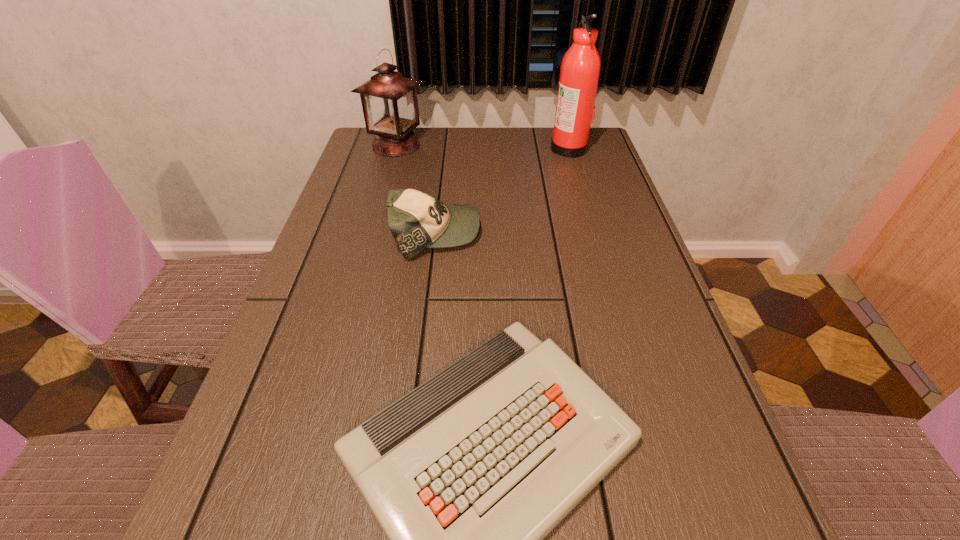
Where is `the tallest object`? the tallest object is located at coordinates (580, 69).

Identify the location of oil lamp. The image size is (960, 540). [389, 101].

The image size is (960, 540). I want to click on the third tallest object, so click(x=417, y=221).

In order to click on the third farthest object in this screenshot , I will do click(417, 221).

You are a GUI agent. You are given a task and a screenshot of the screen. Output one action in this format:
    pyautogui.click(x=<x>, y=<y>)
    Task: Click on the free spot located on the label side of the tallest object
    The image size is (960, 540).
    Given the screenshot: What is the action you would take?
    pyautogui.click(x=424, y=147)

Find the location of a particular element. The image size is (960, 540). free region located on the label side of the tallest object is located at coordinates (534, 147).

Where is `vacant point located on the label side of the tallest object`? vacant point located on the label side of the tallest object is located at coordinates (492, 147).

What are the coordinates of `free space located 0.060m on the right of the oil lamp` in the screenshot? It's located at (447, 146).

Where is `vacant region located 0.300m on the front-facing side of the third tallest object`? vacant region located 0.300m on the front-facing side of the third tallest object is located at coordinates (605, 233).

Where is `fire extinguisher present at the far edge`? fire extinguisher present at the far edge is located at coordinates (580, 69).